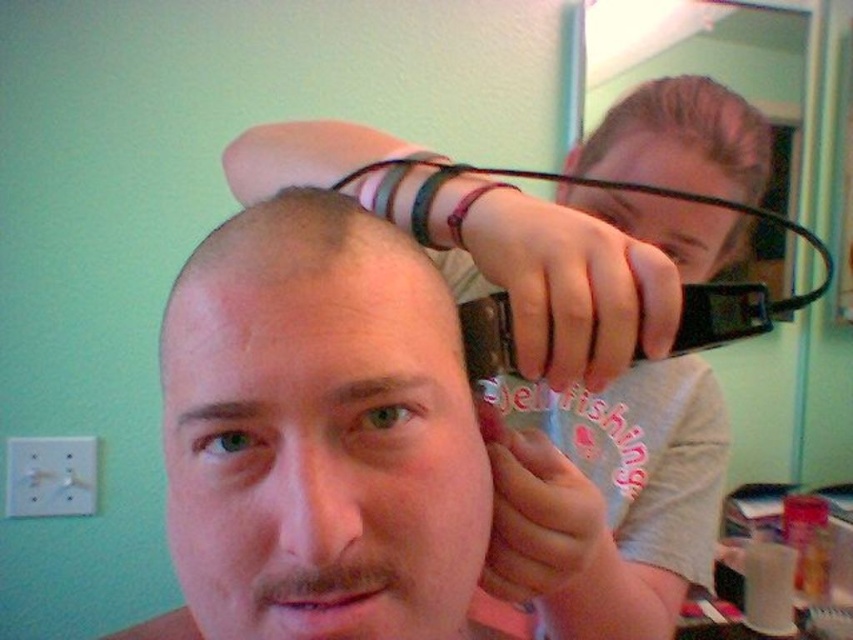
Between smooth skin head at center and matte black hair clipper at upper center, which one appears on the right side from the viewer's perspective?

Positioned to the right is matte black hair clipper at upper center.

Which is behind, point (265, 467) or point (693, 436)?

The point (693, 436) is behind.

Where is `smooth skin head at center`? smooth skin head at center is located at coordinates [x=318, y=432].

Can you confirm if smooth skin head at center is positioned to the right of slicked brown hair at upper center?

No, smooth skin head at center is not to the right of slicked brown hair at upper center.

At what (x,y) coordinates should I click in order to perform the action: click on smooth skin head at center. Please return your answer as a coordinate pair (x, y). The height and width of the screenshot is (640, 853). Looking at the image, I should click on (318, 432).

Image resolution: width=853 pixels, height=640 pixels. In order to click on smooth skin head at center in this screenshot , I will do `click(318, 432)`.

Which is more to the right, matte black hair clipper at upper center or slicked brown hair at upper center?

From the viewer's perspective, slicked brown hair at upper center appears more on the right side.

What do you see at coordinates (610, 500) in the screenshot? I see `matte black hair clipper at upper center` at bounding box center [610, 500].

Locate an element on the screen. This screenshot has height=640, width=853. matte black hair clipper at upper center is located at coordinates (610, 500).

At what (x,y) coordinates should I click in order to perform the action: click on matte black hair clipper at upper center. Please return your answer as a coordinate pair (x, y). Image resolution: width=853 pixels, height=640 pixels. Looking at the image, I should click on (610, 500).